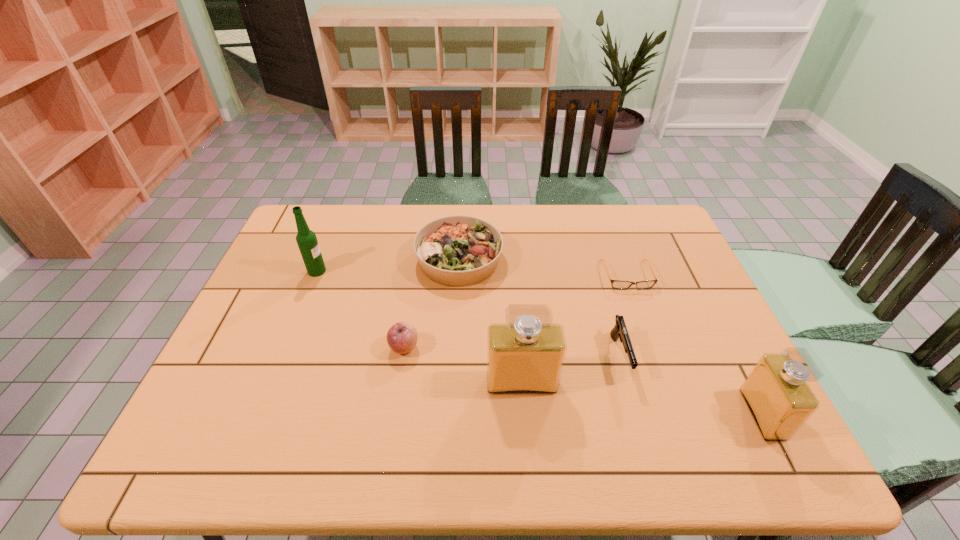
The perfumes are evenly distributed in the image. To maintain this, where would you place another perfume on the left? Please point to a free space. Please provide its 2D coordinates. Your answer should be formatted as a tuple, i.e. [(x, y)], where the tuple contains the x and y coordinates of a point satisfying the conditions above.

[(307, 355)]